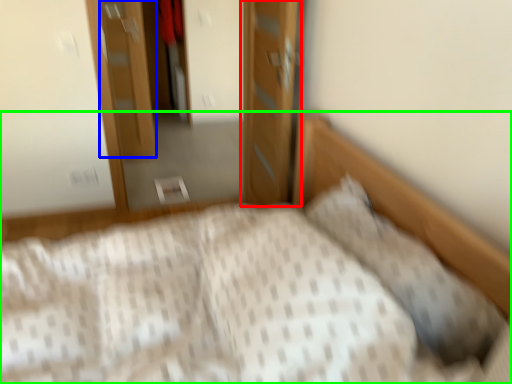
Question: Which object is the closest to the door (highlighted by a red box)? Choose among these: door (highlighted by a blue box) or bed (highlighted by a green box).

Choices:
 (A) door
 (B) bed

Answer: (B)